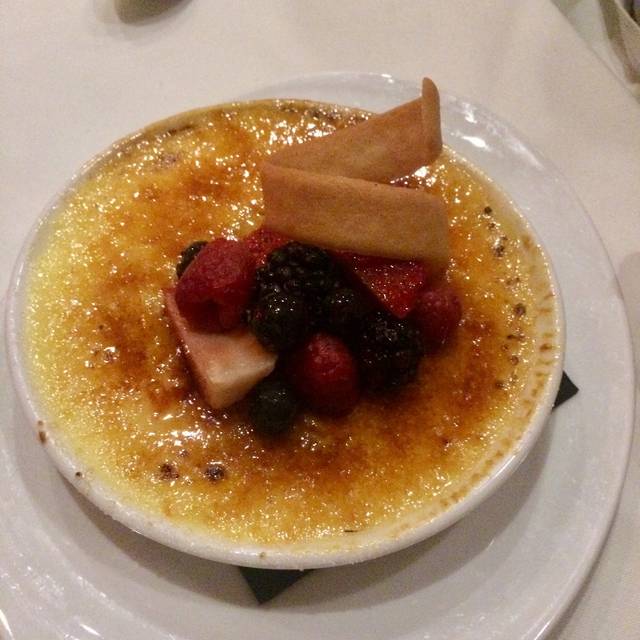
The width and height of the screenshot is (640, 640). I want to click on white plate, so click(513, 582).